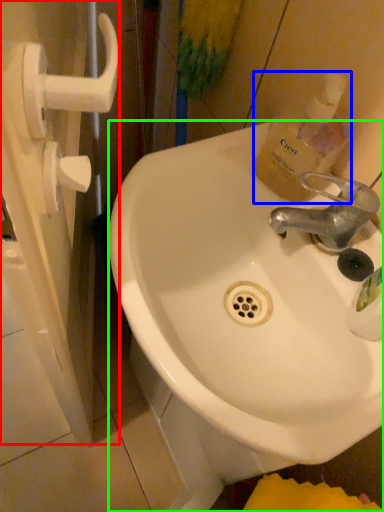
Question: Which object is the closest to the screen door (highlighted by a red box)? Choose among these: bottle (highlighted by a blue box) or sink (highlighted by a green box).

Choices:
 (A) bottle
 (B) sink

Answer: (B)